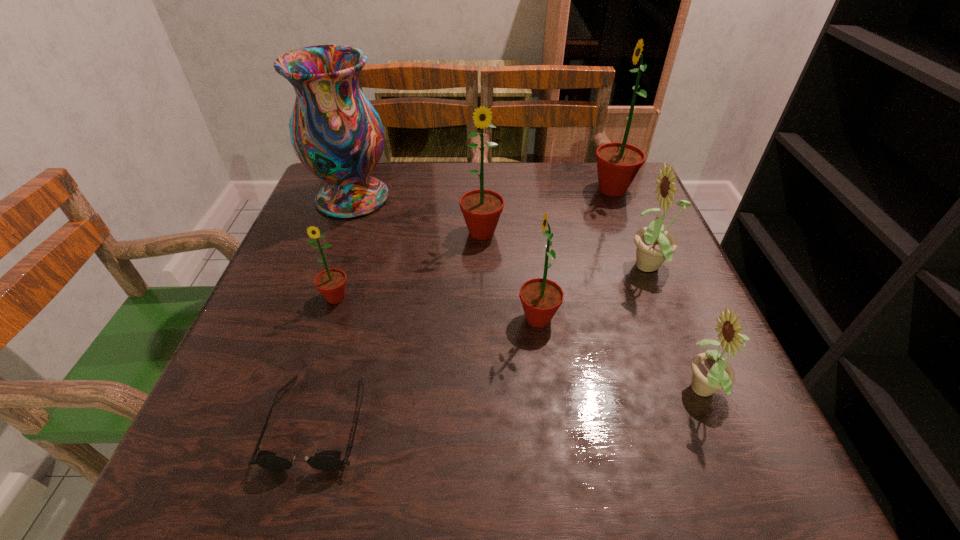
Image resolution: width=960 pixels, height=540 pixels. In the image, there is a desktop. Identify the location of vacant area at the right edge. (618, 301).

The width and height of the screenshot is (960, 540). What are the coordinates of `vacant space at the far left corner of the desktop` in the screenshot? It's located at (383, 172).

Identify the location of vacant region at the far right corner of the desktop. The width and height of the screenshot is (960, 540). (589, 174).

Where is `free space at the near right corner`? This screenshot has height=540, width=960. free space at the near right corner is located at coordinates (698, 439).

Where is `vacant space in between the shortest object and the fifth object from left to right`? vacant space in between the shortest object and the fifth object from left to right is located at coordinates (428, 370).

Image resolution: width=960 pixels, height=540 pixels. Identify the location of vacant space that is in between the third green sunflower from right to left and the vase. (418, 215).

Locate an element on the screen. free spot between the shortest object and the third sunflower from left to right is located at coordinates (428, 370).

Where is `free space between the leftmost green sunflower and the nearest sunflower`? This screenshot has height=540, width=960. free space between the leftmost green sunflower and the nearest sunflower is located at coordinates (521, 345).

The height and width of the screenshot is (540, 960). In order to click on free spot between the smaller yellow sunflower and the tallest sunflower in this screenshot , I will do `click(660, 291)`.

Find the location of a particular element. This screenshot has height=540, width=960. vacant point located between the vase and the sunglasses is located at coordinates (335, 309).